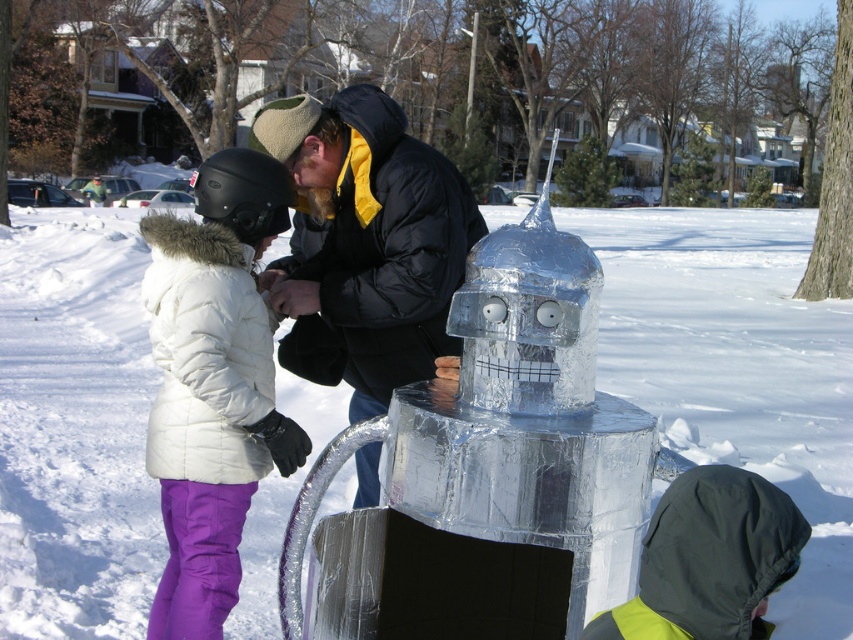
Question: Which of the following is the closest to the observer?

Choices:
 (A) (122, 310)
 (B) (252, 477)
 (C) (367, 474)

Answer: (B)

Question: Which of these objects is positioned farthest from the white puffy jacket at left?

Choices:
 (A) black puffy jacket at center
 (B) shiny metallic robot at center

Answer: (B)

Question: Which object is positioned farthest from the shiny metallic robot at center?

Choices:
 (A) white puffy jacket at left
 (B) black puffy jacket at center

Answer: (A)

Question: Does white puffy jacket at left lie in front of black puffy jacket at center?

Choices:
 (A) no
 (B) yes

Answer: (A)

Question: Can you confirm if shiny metallic robot at center is bigger than white puffy jacket at left?

Choices:
 (A) yes
 (B) no

Answer: (A)

Question: Is shiny metallic robot at center closer to the viewer compared to white puffy jacket at left?

Choices:
 (A) yes
 (B) no

Answer: (A)